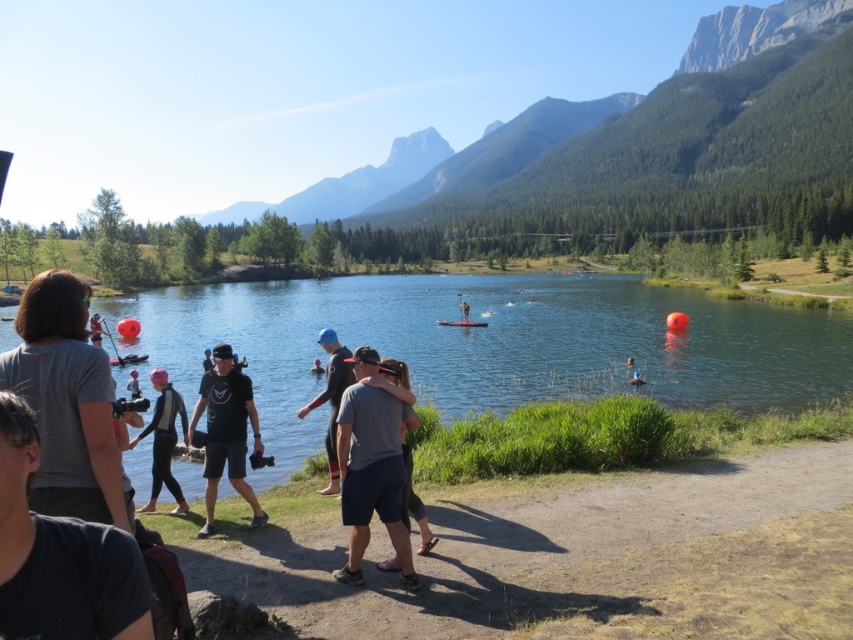
You are a photographer standing at the edge of the lake and want to capture both the point at (403, 483) and the point at (131, 518) in your shot. Which point will appear closer to the camera in the photo?

The point at (403, 483) will appear closer to the camera because it is further to the viewer than the point at (131, 518).

You are planning to set up a temporary floating platform for a small group. The platform requires a space that is wider than the pink fabric at center. Can the clear blue water at center accommodate this requirement?

The clear blue water at center has a larger width than the pink fabric at center, so it can accommodate the platform requiring a space wider than the pink fabric at center.